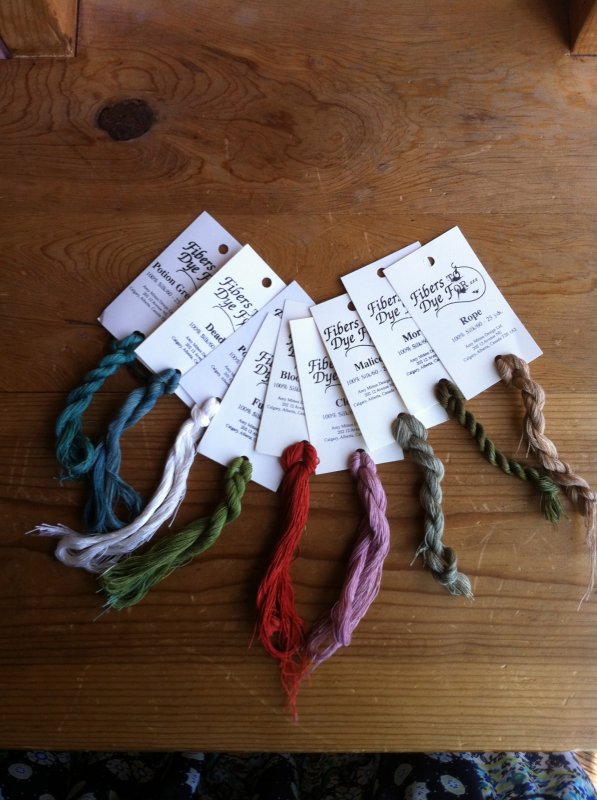
The width and height of the screenshot is (597, 800). Find the location of `riser`. riser is located at coordinates (36, 37), (578, 28).